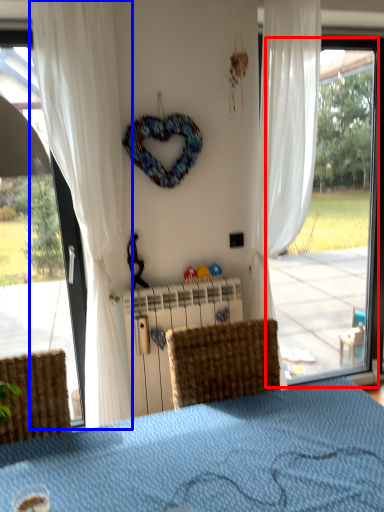
Question: Which object is further to the camera taking this photo, window (highlighted by a red box) or curtain (highlighted by a blue box)?

Choices:
 (A) window
 (B) curtain

Answer: (A)